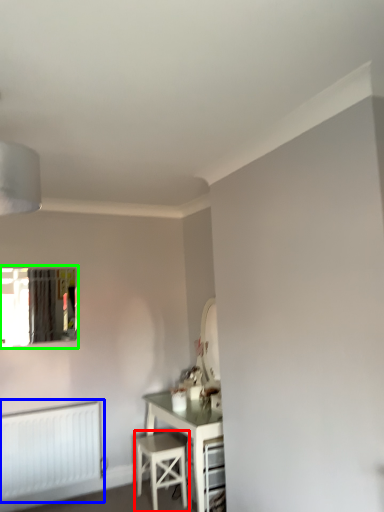
Question: Considering the real-world distances, which object is closest to stool (highlighted by a red box)? radiator (highlighted by a blue box) or window (highlighted by a green box).

Choices:
 (A) radiator
 (B) window

Answer: (A)